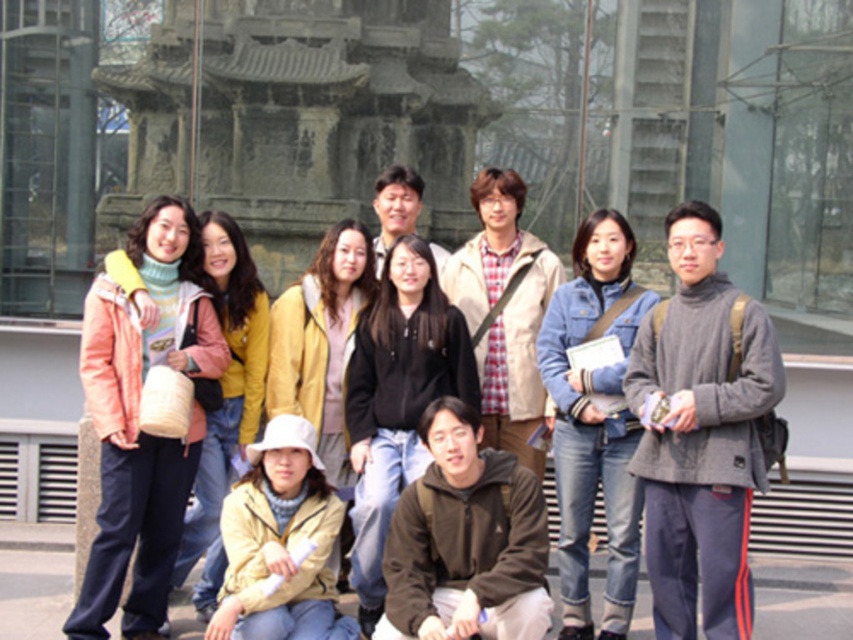
Question: Can you confirm if gray wool sweater at center is positioned to the left of matte yellow jacket at upper left?

Choices:
 (A) no
 (B) yes

Answer: (A)

Question: Can you confirm if gray wool sweater at center is wider than brown fleece jacket at lower center?

Choices:
 (A) no
 (B) yes

Answer: (B)

Question: Which of these objects is positioned farthest from the brown fleece jacket at lower center?

Choices:
 (A) pink fleece jacket at left
 (B) gray wool sweater at center
 (C) yellow matte jacket at lower center

Answer: (A)

Question: Which object is closer to the camera taking this photo?

Choices:
 (A) pink fleece jacket at left
 (B) yellow matte jacket at lower center
 (C) blue denim jeans at center
 (D) brown fleece jacket at lower center

Answer: (A)

Question: Is matte yellow jacket at upper left thinner than yellow matte jacket at lower center?

Choices:
 (A) yes
 (B) no

Answer: (B)

Question: Which object is farther from the camera taking this photo?

Choices:
 (A) brown fleece jacket at lower center
 (B) blue denim jeans at center

Answer: (B)